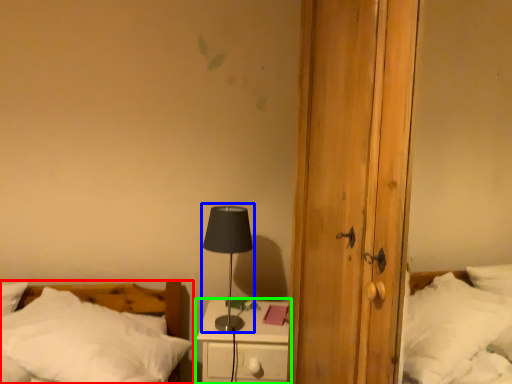
Question: Based on their relative distances, which object is farther from bed (highlighted by a red box)? Choose from table lamp (highlighted by a blue box) and nightstand (highlighted by a green box).

Choices:
 (A) table lamp
 (B) nightstand

Answer: (A)